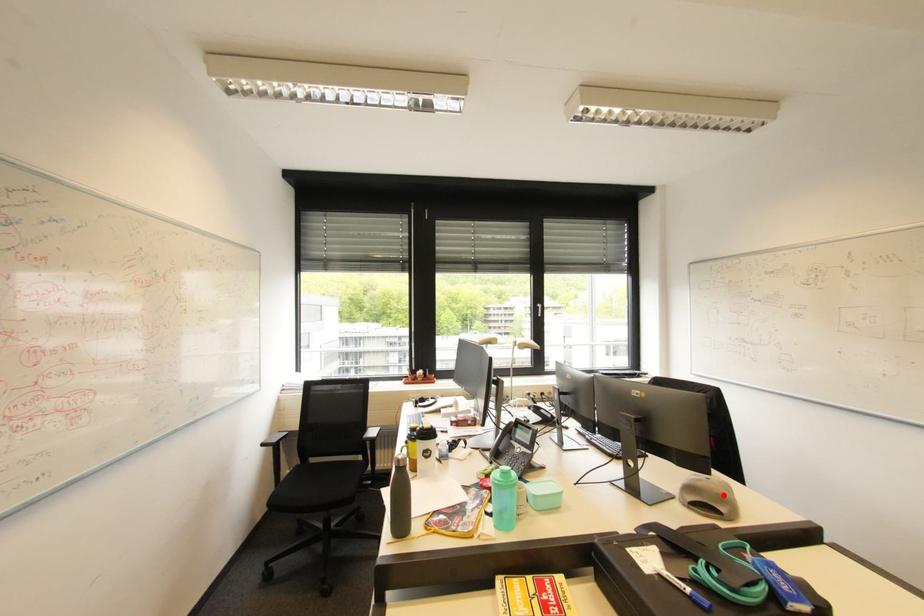
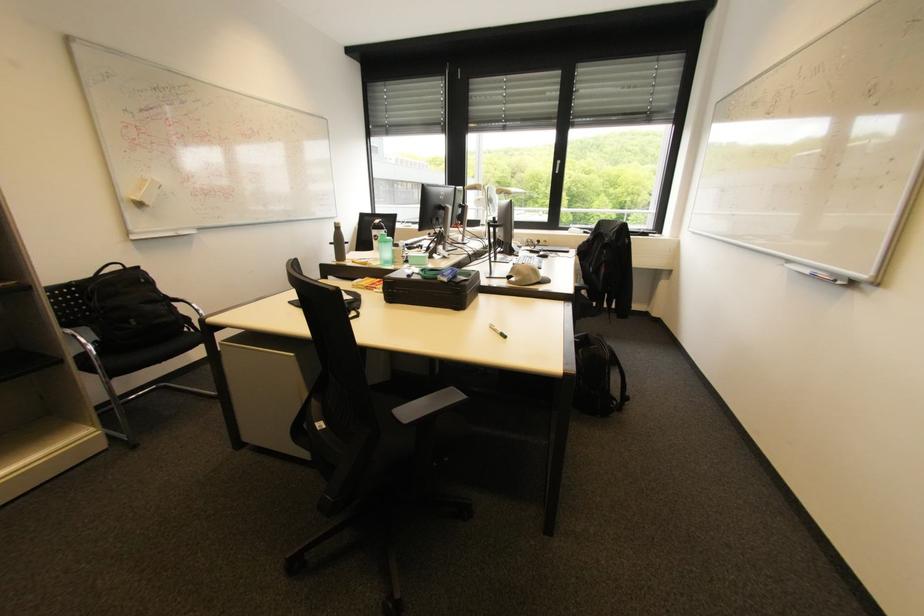
The point at the highlighted location is marked in the first image. Where is the corresponding point in the second image?

(524, 270)